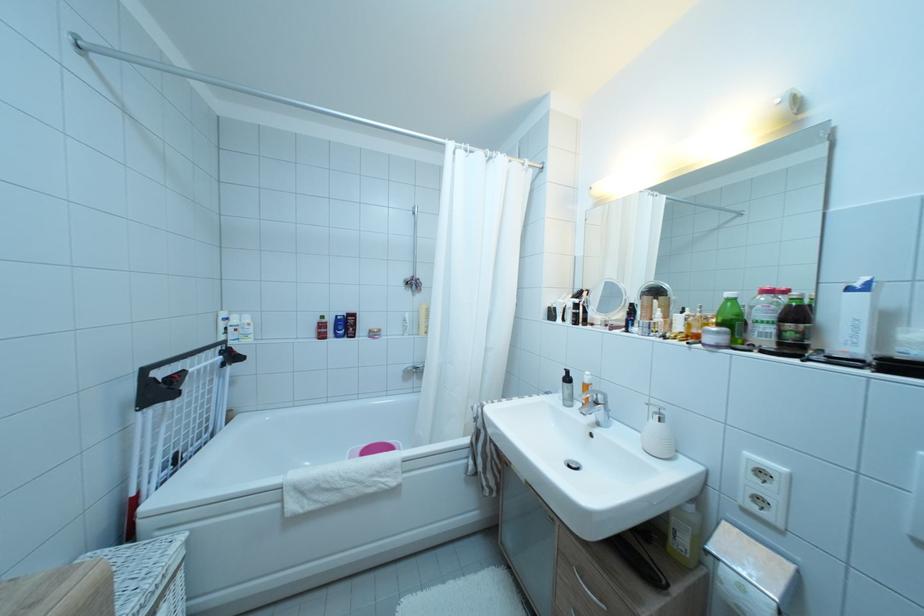
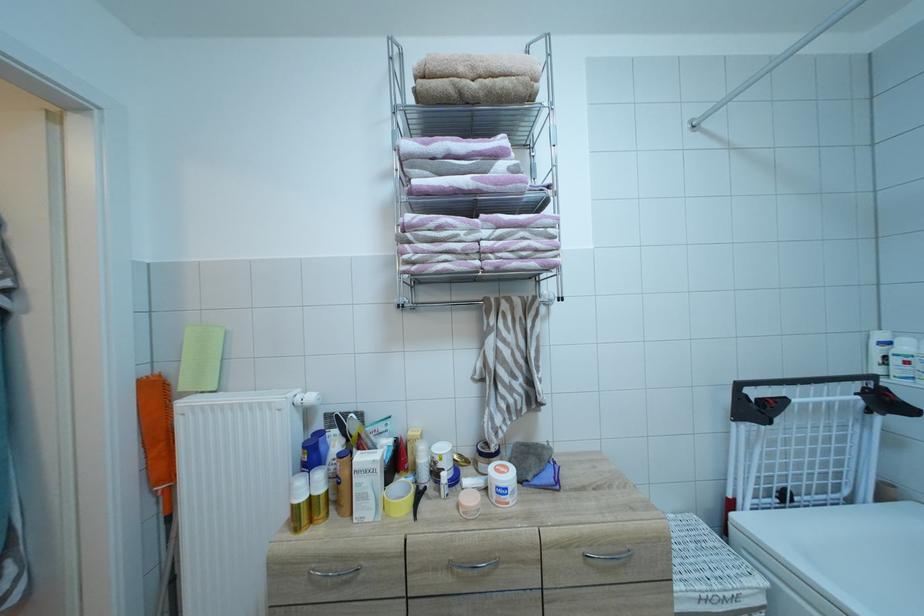
Question: The images are taken continuously from a first-person perspective. In which direction is your viewpoint rotating?

Choices:
 (A) Left
 (B) Right
 (C) Up
 (D) Down

Answer: (A)